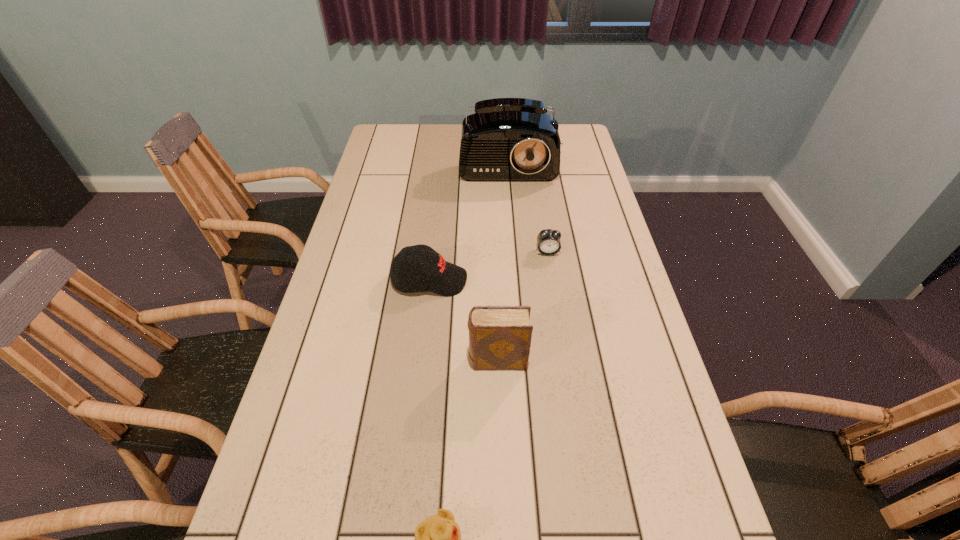
Locate an element on the screen. The image size is (960, 540). free space located 0.190m on the spine side of the diary is located at coordinates (391, 361).

Find the location of a particular element. vacant position located 0.120m on the spine side of the diary is located at coordinates (x=420, y=361).

Image resolution: width=960 pixels, height=540 pixels. What are the coordinates of `free region located 0.210m on the front-facing side of the third nearest object` in the screenshot? It's located at (540, 280).

Where is `vacant region located on the front side of the alarm clock`? vacant region located on the front side of the alarm clock is located at coordinates point(551,276).

You are a GUI agent. You are given a task and a screenshot of the screen. Output one action in this format:
    pyautogui.click(x=<x>, y=<y>)
    Task: Click on the object that is at the far edge
    
    Given the screenshot: What is the action you would take?
    click(507, 139)

Where is `object that is at the right edge`? object that is at the right edge is located at coordinates (507, 139).

The image size is (960, 540). Identify the location of object that is at the far right corner. (507, 139).

You are a GUI agent. You are given a task and a screenshot of the screen. Output one action in this format:
    pyautogui.click(x=<x>, y=<y>)
    Task: Click on the vacant space at the far edge of the desktop
    The image size is (960, 540).
    Given the screenshot: What is the action you would take?
    click(x=459, y=125)

Locate an element on the screen. The height and width of the screenshot is (540, 960). free space at the left edge of the desktop is located at coordinates (373, 262).

The image size is (960, 540). In the image, there is a desktop. In order to click on vacant space at the right edge in this screenshot , I will do `click(624, 454)`.